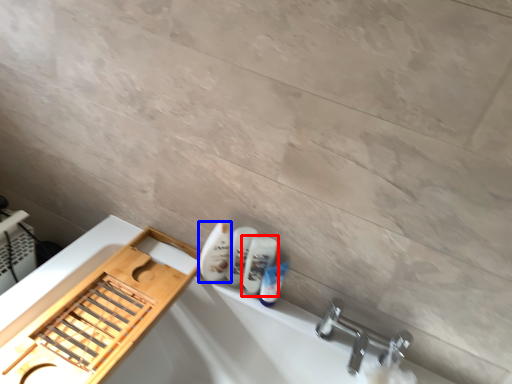
Question: Which point is closer to the camera, mouthwash (highlighted by a red box) or toiletry (highlighted by a blue box)?

Choices:
 (A) mouthwash
 (B) toiletry

Answer: (B)